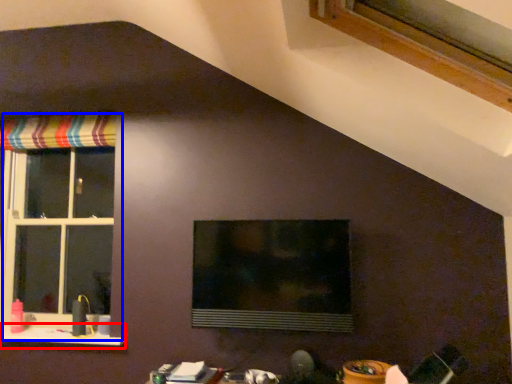
Question: Which object is further to the camera taking this photo, window sill (highlighted by a red box) or window (highlighted by a blue box)?

Choices:
 (A) window sill
 (B) window

Answer: (B)